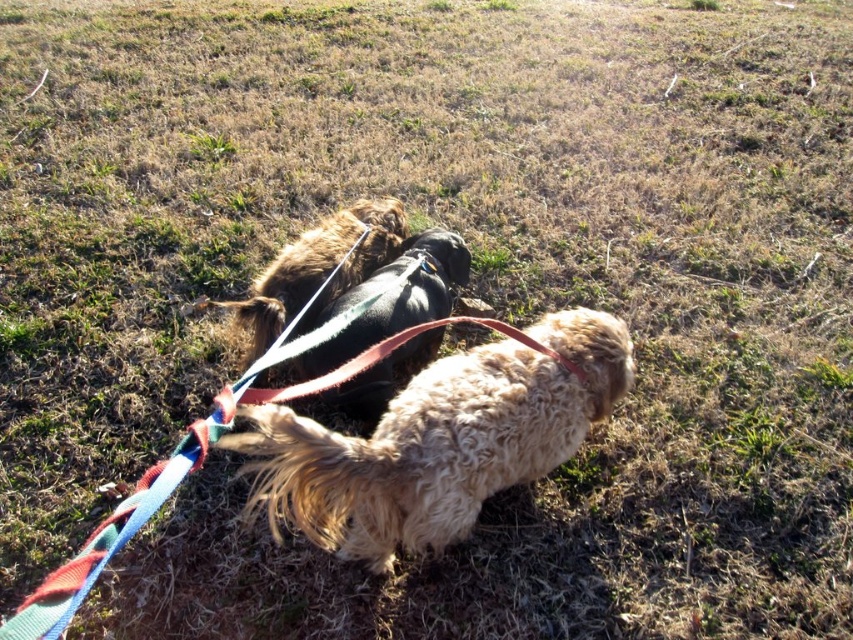
Can you confirm if fuzzy fur dog at center is wider than multicolored fabric leash at center?

Yes, fuzzy fur dog at center is wider than multicolored fabric leash at center.

Who is more distant from viewer, (289,467) or (80,563)?

The point (289,467) is more distant.

Who is more forward, (521, 461) or (108, 532)?

Point (108, 532)

The height and width of the screenshot is (640, 853). Find the location of `fuzzy fur dog at center`. fuzzy fur dog at center is located at coordinates (438, 440).

Is multicolored fabric leash at center to the left of fuzzy brown dog at center from the viewer's perspective?

Incorrect, multicolored fabric leash at center is not on the left side of fuzzy brown dog at center.

Is multicolored fabric leash at center positioned before fuzzy brown dog at center?

Yes, it is.

Describe the element at coordinates (184, 476) in the screenshot. I see `multicolored fabric leash at center` at that location.

Locate an element on the screen. The width and height of the screenshot is (853, 640). multicolored fabric leash at center is located at coordinates (184, 476).

Which is more to the left, shiny black dog at center or fuzzy brown dog at center?

fuzzy brown dog at center

Between shiny black dog at center and fuzzy brown dog at center, which one is positioned higher?

Positioned higher is fuzzy brown dog at center.

Who is more forward, (350,323) or (334,228)?

Positioned in front is point (350,323).

Locate an element on the screen. shiny black dog at center is located at coordinates (392, 300).